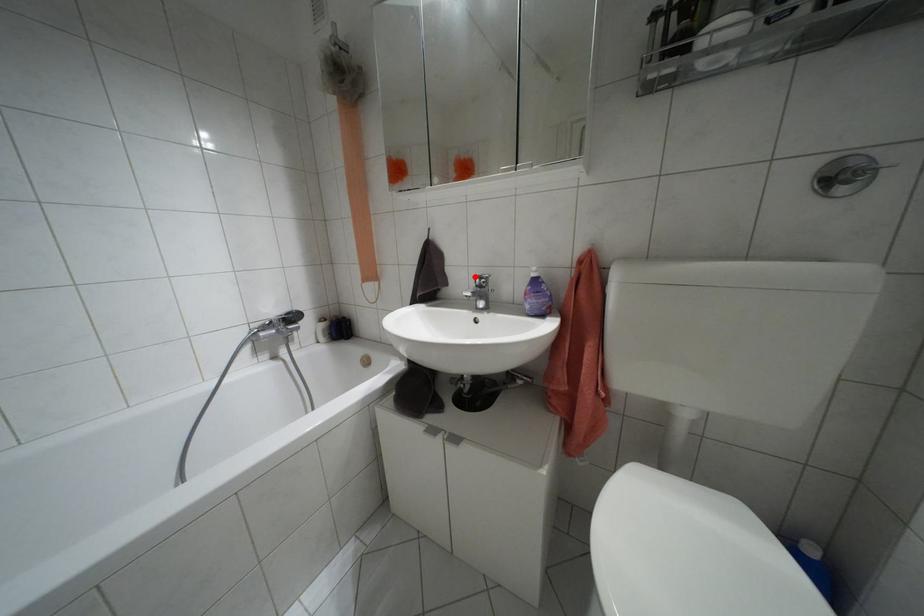
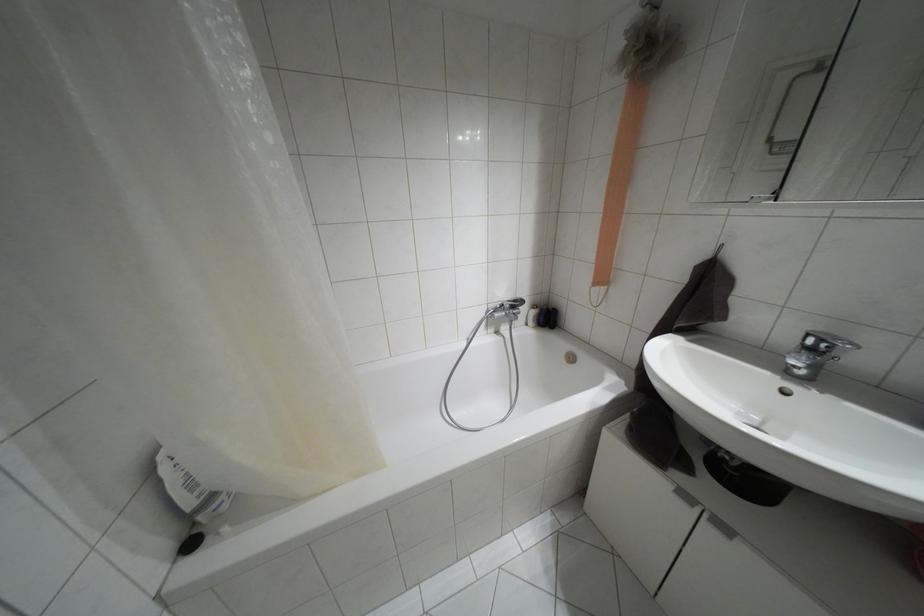
Locate, in the second image, the point that corresponds to the highlighted location in the first image.

(808, 334)